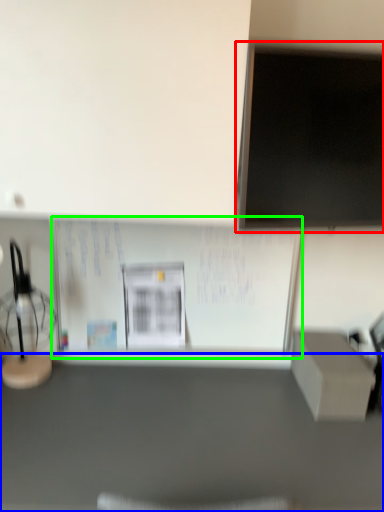
Question: Which is nearer to the computer monitor (highlighted by a red box)? furniture (highlighted by a blue box) or bulletin board (highlighted by a green box).

Choices:
 (A) furniture
 (B) bulletin board

Answer: (B)